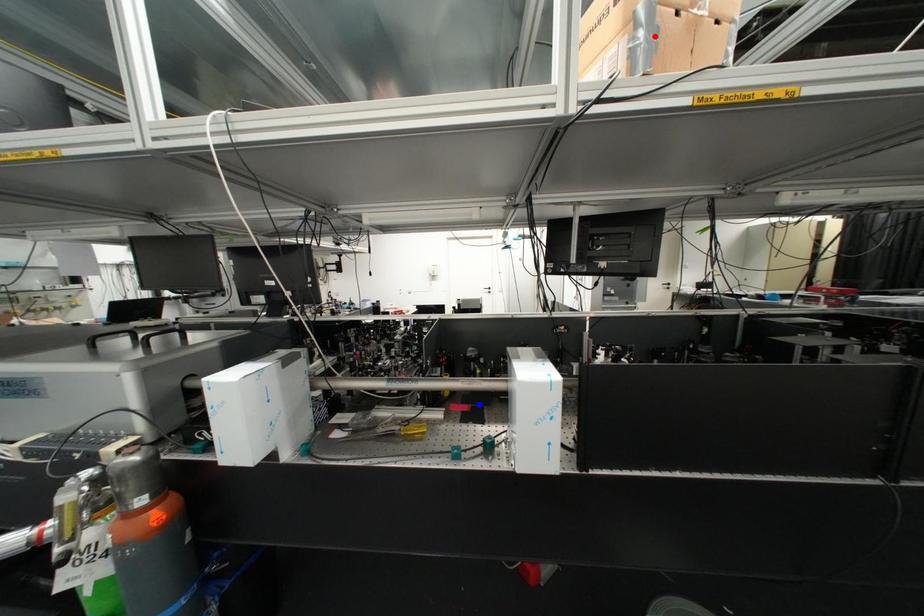
Question: Two points are marked on the image. Which point is closer to the camera?

Choices:
 (A) Blue point is closer.
 (B) Red point is closer.

Answer: (B)